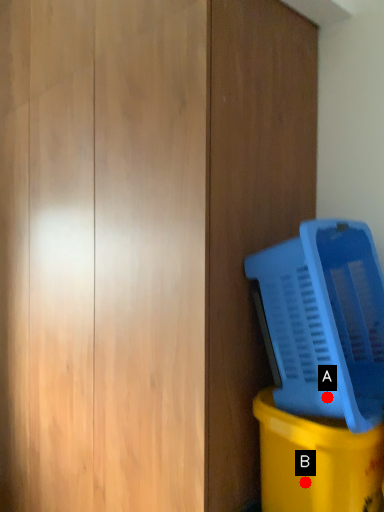
Question: Two points are circled on the image, labeled by A and B beside each circle. Which point is further to the camera?

Choices:
 (A) A is further
 (B) B is further

Answer: (B)